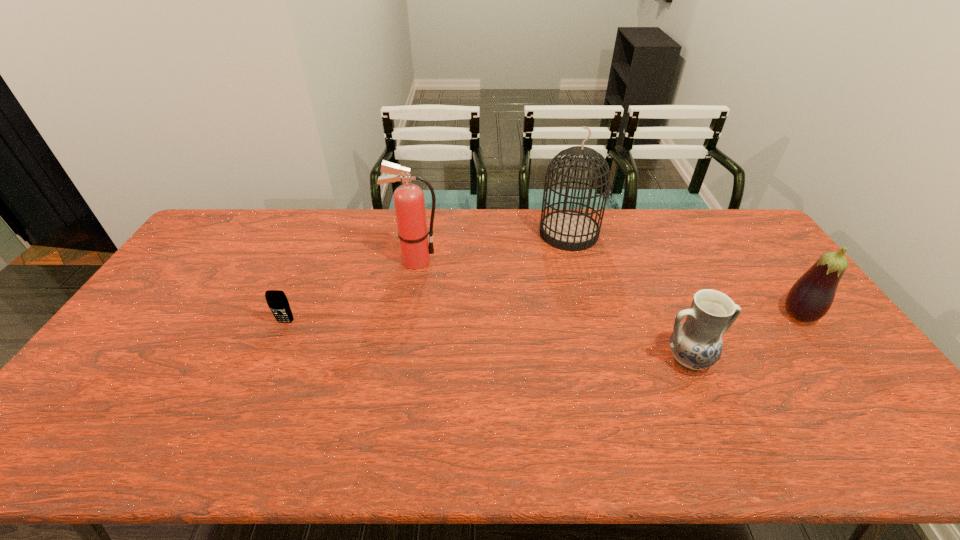
Locate an element on the screen. The width and height of the screenshot is (960, 540). vacant space located on the front of the third object from left to right is located at coordinates (593, 331).

The image size is (960, 540). Identify the location of vacant point located 0.090m on the hose direction of the fire extinguisher. (468, 261).

I want to click on vacant space located 0.310m on the back of the rightmost object, so click(x=744, y=240).

I want to click on free space located on the front of the second shortest object, so click(714, 422).

Image resolution: width=960 pixels, height=540 pixels. Identify the location of vacant space located 0.140m on the screen of the shortest object. (267, 364).

Find the location of a particular element. The height and width of the screenshot is (540, 960). object at the far edge is located at coordinates (569, 230).

You are a GUI agent. You are given a task and a screenshot of the screen. Output one action in this format:
    pyautogui.click(x=<x>, y=<y>)
    Task: Click on the object that is at the right edge
    This screenshot has width=960, height=540.
    Given the screenshot: What is the action you would take?
    pyautogui.click(x=810, y=298)

In the image, there is a desktop. Identify the location of free space at the far edge. The image size is (960, 540). (518, 232).

In the image, there is a desktop. At what (x,y) coordinates should I click in order to perform the action: click on vacant space at the near edge. Please return your answer as a coordinate pair (x, y). This screenshot has width=960, height=540. Looking at the image, I should click on (646, 439).

In the image, there is a desktop. At what (x,y) coordinates should I click in order to perform the action: click on vacant space at the right edge. Please return your answer as a coordinate pair (x, y). Image resolution: width=960 pixels, height=540 pixels. Looking at the image, I should click on (853, 357).